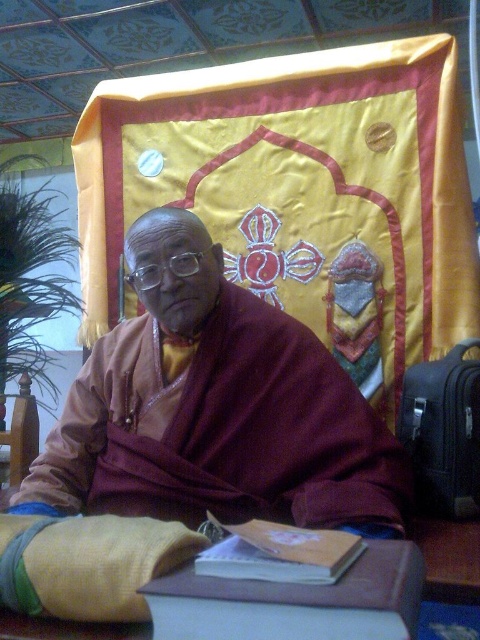
You are a visitor in a temple and see the brown leather table at center and the matte brown book at center. Which object is positioned to the right side of the other?

The brown leather table at center is to the right of the matte brown book at center.

Looking at this image, you are a photographer setting up a shoot in this room. You need to position a 1.5 meter tall tripod between the maroon woolen robe at center and the brown leather table at center. Can the tripod fit vertically between them without touching either object?

The maroon woolen robe at center is taller than the brown leather table at center. The tripod is 1.5 meters tall, so it may not fit vertically between them if the robe is taller than 1.5 meters. However, since the exact height of the robe isn